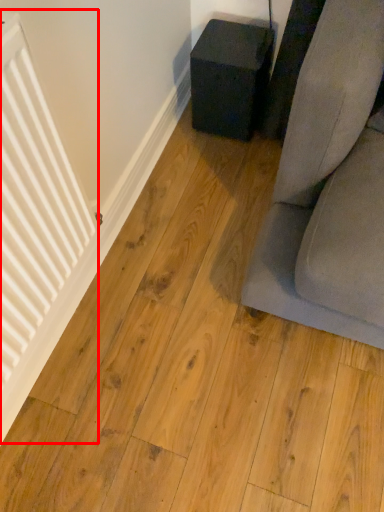
Question: Considering the relative positions of radiator (annotated by the red box) and furniture in the image provided, where is radiator (annotated by the red box) located with respect to the staircase?

Choices:
 (A) left
 (B) right

Answer: (A)